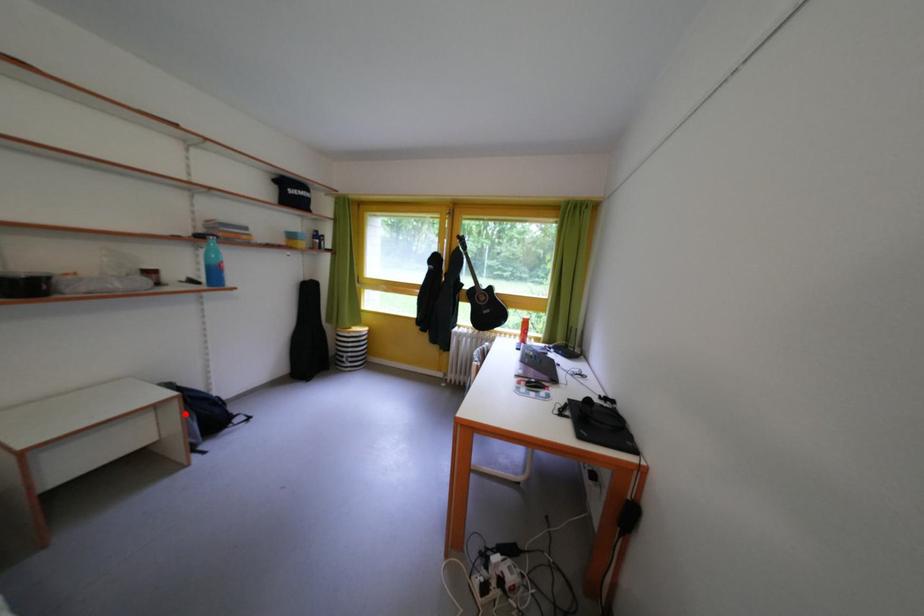
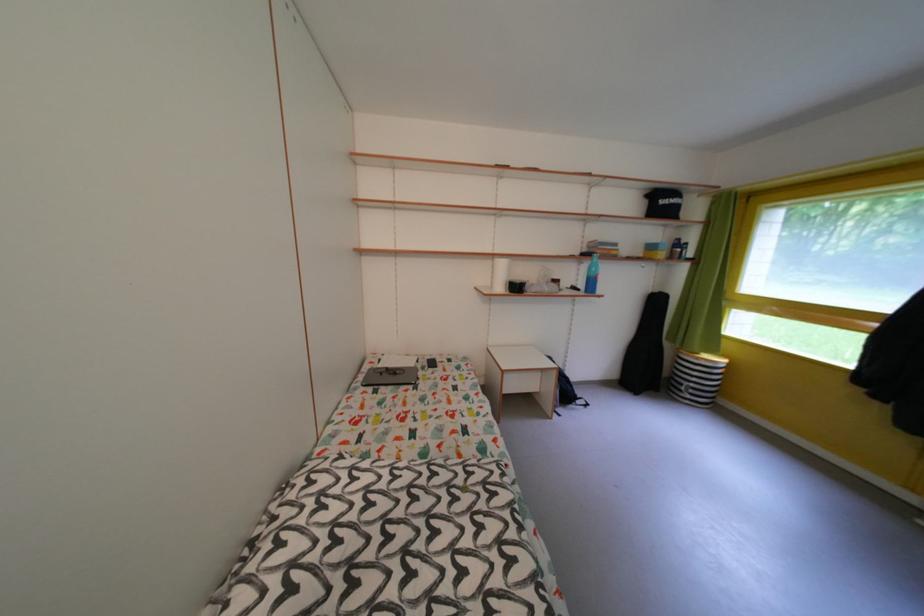
In the second image, find the point that corresponds to the highlighted location in the first image.

(563, 382)